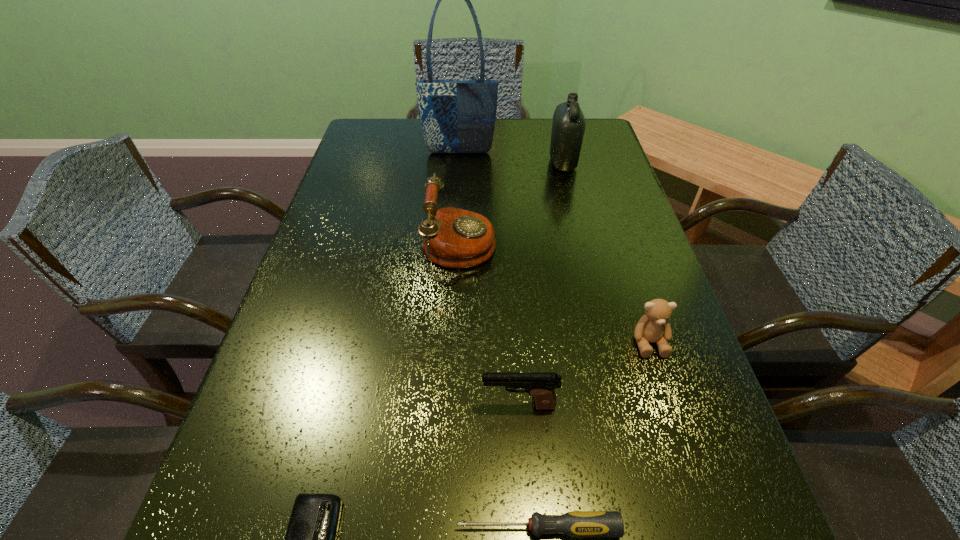
Find the location of a particular element. shopping bag is located at coordinates (457, 116).

Where is `the second tallest object`? Image resolution: width=960 pixels, height=540 pixels. the second tallest object is located at coordinates (568, 127).

At what (x,y) coordinates should I click in order to perform the action: click on the sixth object from left to right. Please return your answer as a coordinate pair (x, y). This screenshot has height=540, width=960. Looking at the image, I should click on (568, 127).

Locate an element on the screen. Image resolution: width=960 pixels, height=540 pixels. the third farthest object is located at coordinates (455, 238).

The width and height of the screenshot is (960, 540). I want to click on the fifth shortest object, so click(x=455, y=238).

Locate an element on the screen. The height and width of the screenshot is (540, 960). teddy bear is located at coordinates (652, 327).

At what (x,y) coordinates should I click in order to perform the action: click on the fourth nearest object. Please return your answer as a coordinate pair (x, y). The width and height of the screenshot is (960, 540). Looking at the image, I should click on (652, 327).

Where is `the fifth farthest object`? This screenshot has width=960, height=540. the fifth farthest object is located at coordinates (541, 386).

Where is `blank space located on the front-facing side of the shopping bag`? blank space located on the front-facing side of the shopping bag is located at coordinates (457, 193).

The image size is (960, 540). What are the coordinates of `vacant area situated 0.250m on the front of the second tallest object` in the screenshot? It's located at (x=580, y=233).